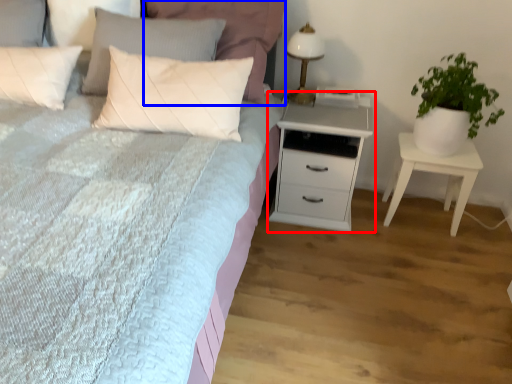
Question: Which point is further to the camera, chest of drawers (highlighted by a red box) or pillow (highlighted by a blue box)?

Choices:
 (A) chest of drawers
 (B) pillow

Answer: (A)